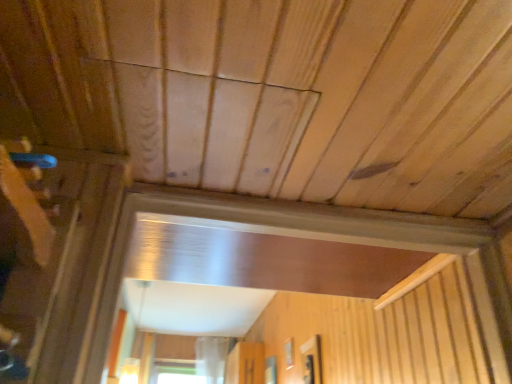
Question: Based on their sizes in the image, would you say transparent glass window at center, the 3th window in the back-to-front sequence, is bigger or smaller than transparent plastic screen door at center?

Choices:
 (A) big
 (B) small

Answer: (B)

Question: From a real-world perspective, is transparent glass window at center, positioned as the 1th window in front-to-back order, positioned above or below transparent plastic screen door at center?

Choices:
 (A) above
 (B) below

Answer: (B)

Question: Which of these objects is positioned farthest from the transparent glass window at center, which is the first window from left to right?

Choices:
 (A) transparent glass window at center, which is the 2th window from front to back
 (B) transparent glass window at center, the 3th window positioned from the left
 (C) transparent plastic screen door at center

Answer: (B)

Question: Which is nearer to the transparent glass window at center, positioned as the 1th window in front-to-back order?

Choices:
 (A) transparent glass window at center, the third window from the front
 (B) transparent plastic screen door at center
 (C) transparent glass window at center, the second window positioned from the right

Answer: (C)